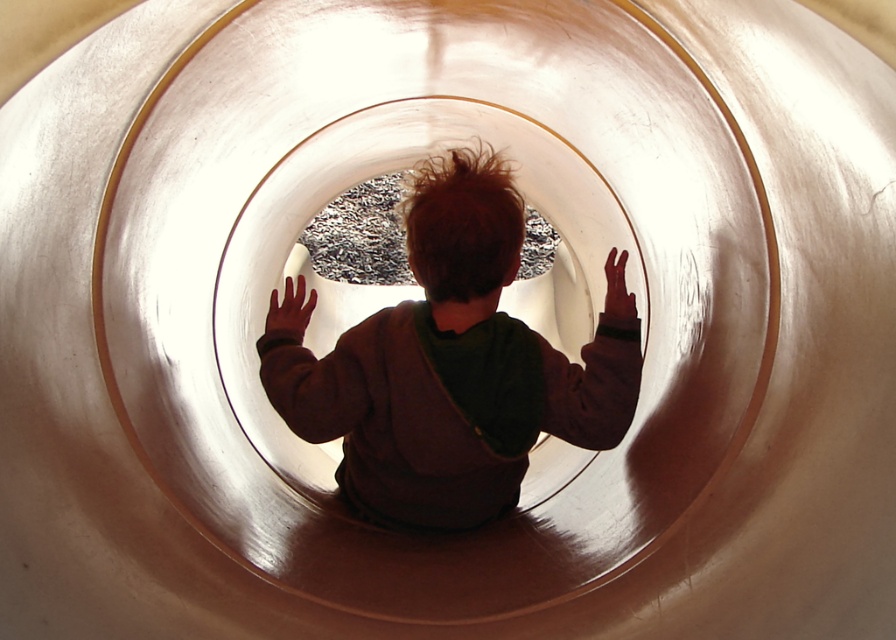
Does matte brown hoodie at center appear on the right side of matte brown hand at center?

Yes, matte brown hoodie at center is to the right of matte brown hand at center.

Is matte brown hoodie at center shorter than matte brown hand at center?

No.

The height and width of the screenshot is (640, 896). I want to click on matte brown hoodie at center, so click(451, 368).

Who is taller, matte brown hand at center or brown leather hand at center?

brown leather hand at center is taller.

Find the location of `matte brown hand at center`. matte brown hand at center is located at coordinates click(x=290, y=307).

Does matte brown hoodie at center appear under brown leather hand at center?

Indeed, matte brown hoodie at center is positioned under brown leather hand at center.

Can you confirm if matte brown hoodie at center is taller than brown leather hand at center?

Correct, matte brown hoodie at center is much taller as brown leather hand at center.

Which is in front, point (476, 372) or point (612, 278)?

Positioned in front is point (476, 372).

You are a GUI agent. You are given a task and a screenshot of the screen. Output one action in this format:
    pyautogui.click(x=<x>, y=<y>)
    Task: Click on the matte brown hoodie at center
    Image resolution: width=896 pixels, height=640 pixels.
    Given the screenshot: What is the action you would take?
    pyautogui.click(x=451, y=368)